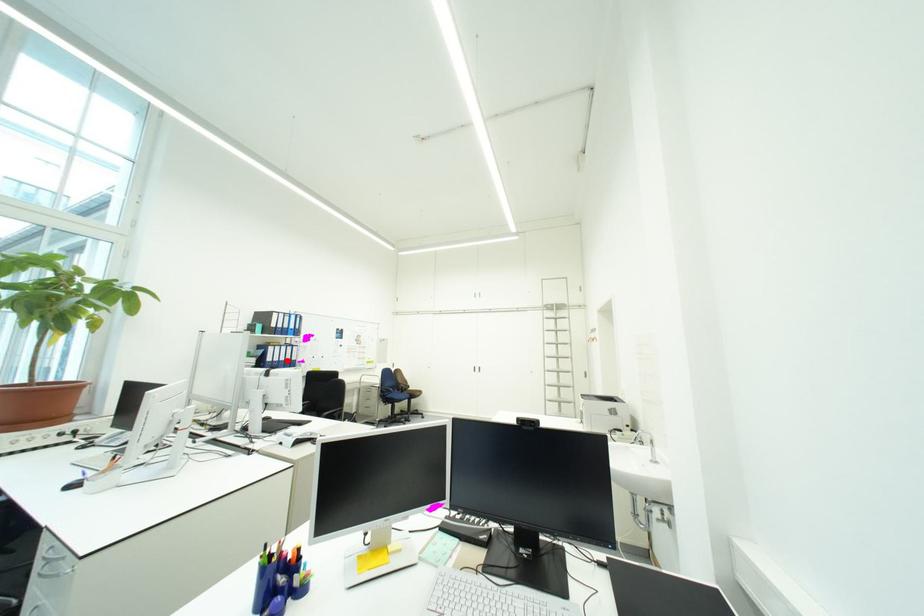
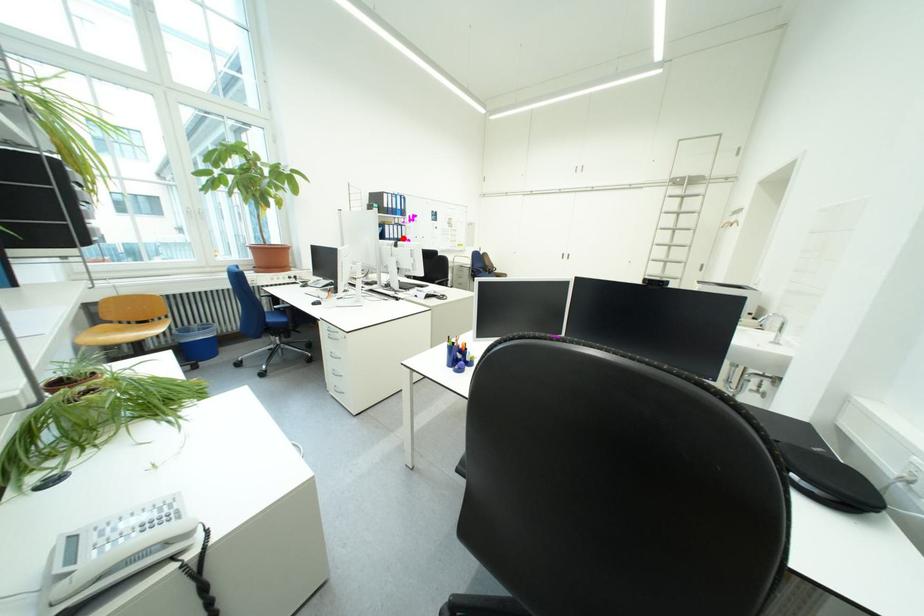
From the picture: I am providing you with two images of the same scene from different viewpoints. A red point is marked on the first image and another point is marked on the second image. Is the marked point in image1 the same physical position as the marked point in image2?

Yes